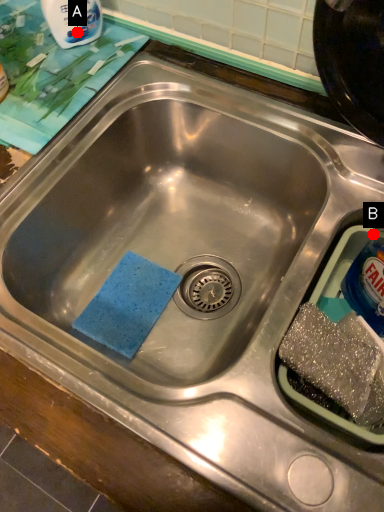
Question: Two points are circled on the image, labeled by A and B beside each circle. Which point appears closest to the camera in this image?

Choices:
 (A) A is closer
 (B) B is closer

Answer: (B)